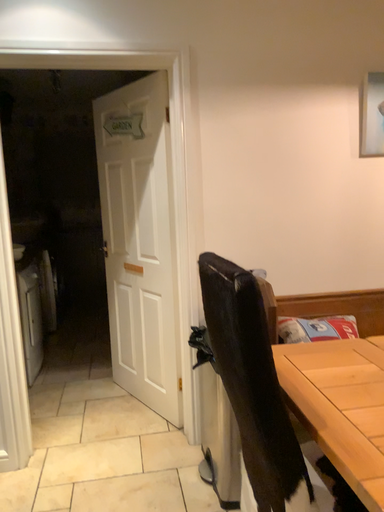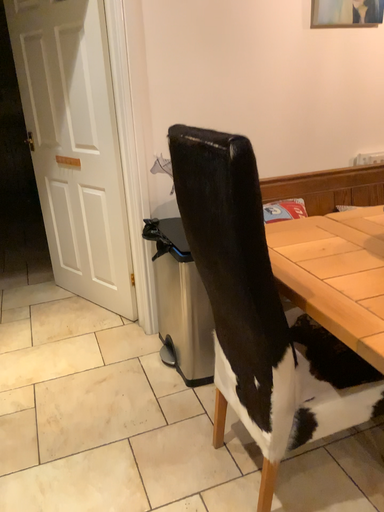
Question: How did the camera likely rotate when shooting the video?

Choices:
 (A) rotated left
 (B) rotated right

Answer: (B)